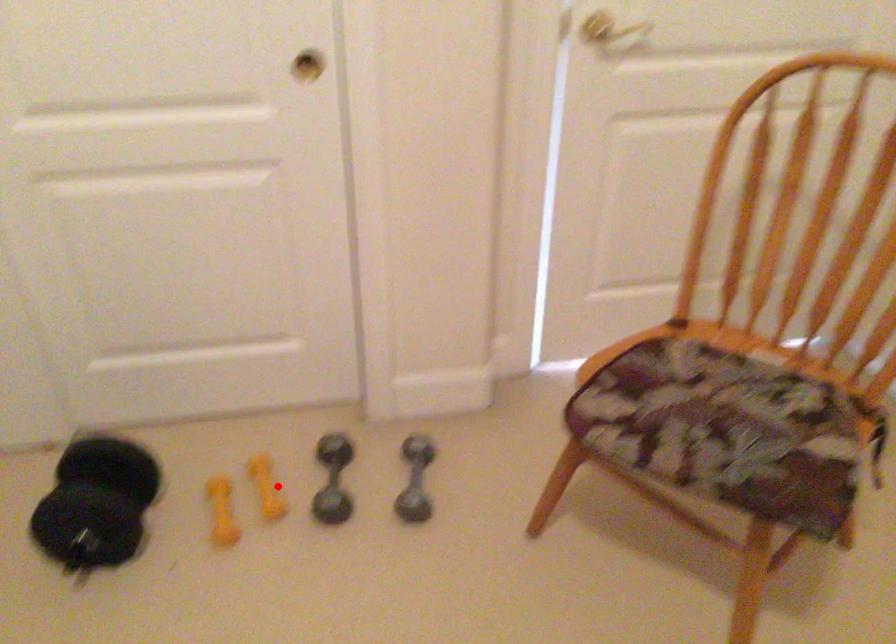
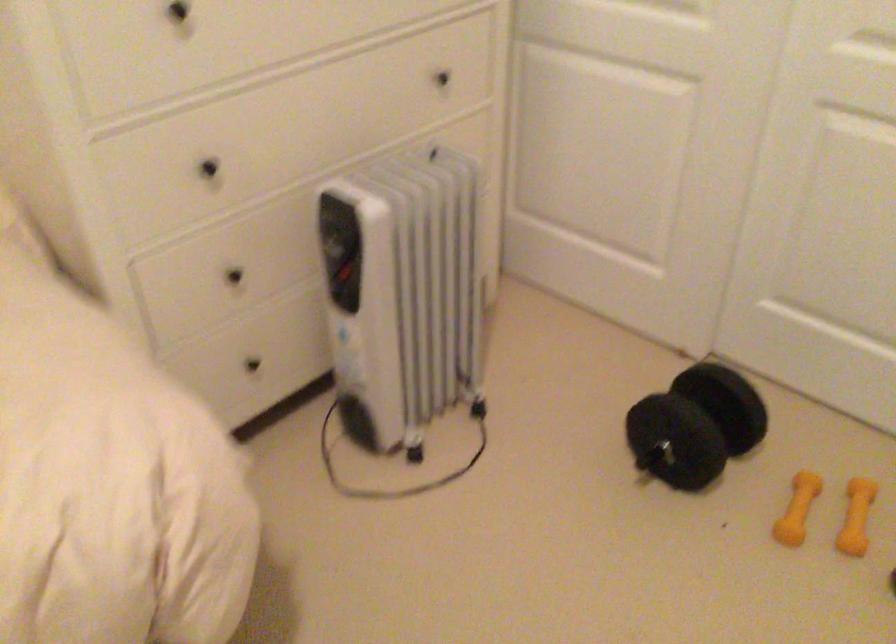
Question: I am providing you with two images of the same scene from different viewpoints. Given a red point in image1, look at the same physical point in image2. Is it:

Choices:
 (A) Closer to the viewpoint
 (B) Farther from the viewpoint

Answer: (A)